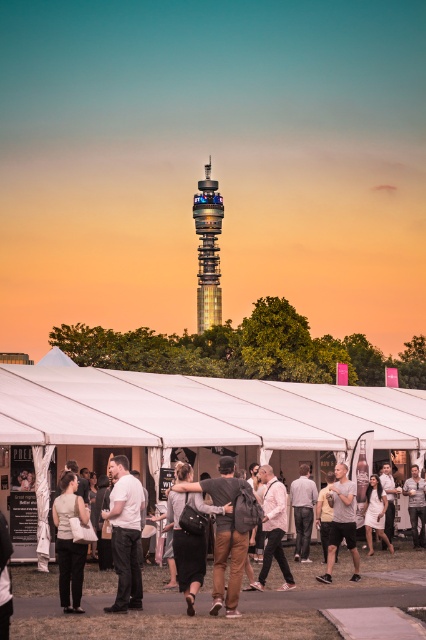
Question: Does white fabric tent at lower center appear over white satin dress at center?

Choices:
 (A) no
 (B) yes

Answer: (B)

Question: Which point is closer to the camera?

Choices:
 (A) (121, 509)
 (B) (339, 528)

Answer: (A)

Question: Can you confirm if white fabric tent at lower center is positioned to the left of silver metallic tower at center?

Choices:
 (A) no
 (B) yes

Answer: (B)

Question: Estimate the real-world distances between objects in this image. Which object is farther from the light gray fabric at center?

Choices:
 (A) pink matte shirt at center
 (B) white cotton shirt at center

Answer: (B)

Question: Can you confirm if dark gray cotton shirt at center is bigger than white satin dress at center?

Choices:
 (A) yes
 (B) no

Answer: (A)

Question: Which object appears farthest from the camera in this image?

Choices:
 (A) matte white blouse at center
 (B) white cotton shirt at center
 (C) silver metallic tower at center
 (D) pink matte shirt at center

Answer: (C)